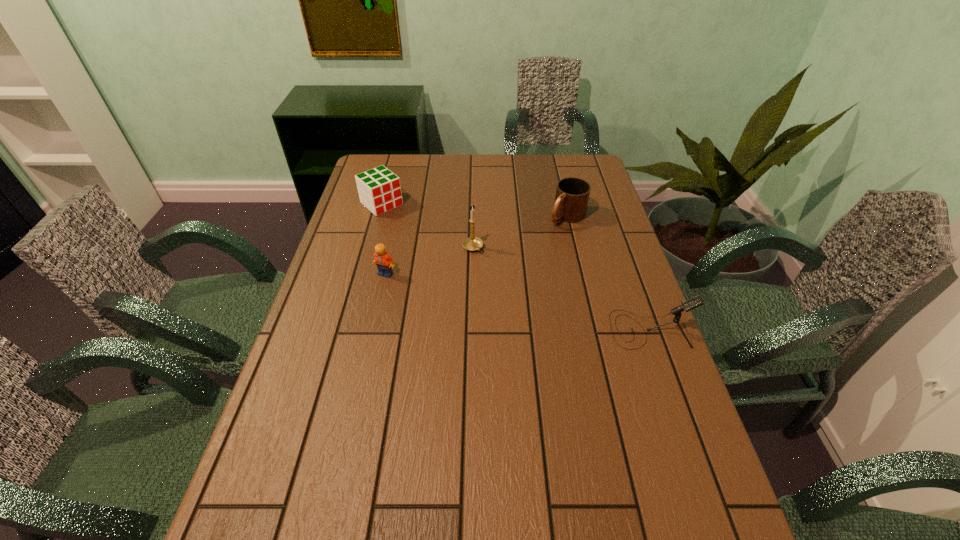
Locate an element on the screen. free space on the desktop that is between the Lego and the microphone and is positioned on the red face of the cube is located at coordinates (491, 296).

Where is `vacant space on the desktop that is between the second nearest object and the nearest object and is positioned on the handle side of the candle holder`? vacant space on the desktop that is between the second nearest object and the nearest object and is positioned on the handle side of the candle holder is located at coordinates (516, 301).

This screenshot has width=960, height=540. What are the coordinates of `free space on the desktop that is between the Lego and the nearest object and is positioned on the side of the mug with the handle` in the screenshot? It's located at (473, 292).